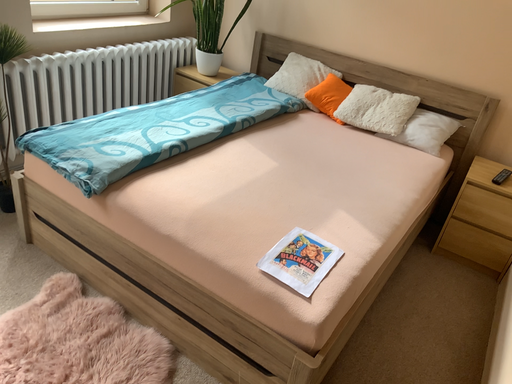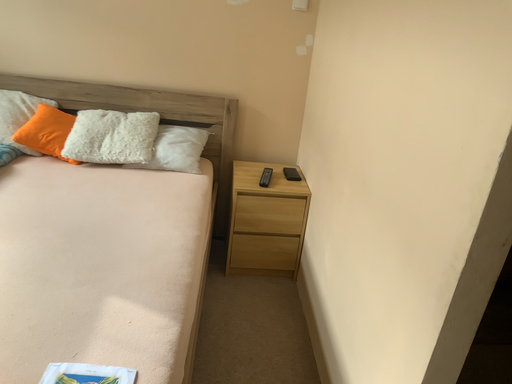
Question: How did the camera likely rotate when shooting the video?

Choices:
 (A) rotated downward
 (B) rotated upward

Answer: (B)